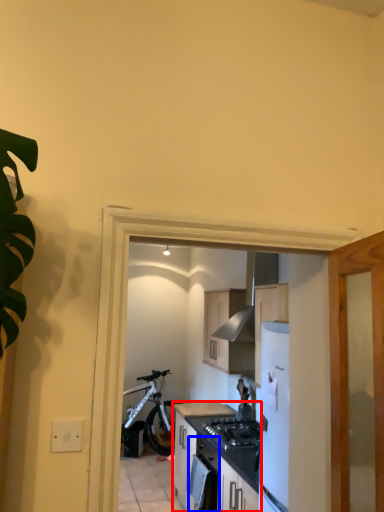
Question: Which point is further to the camera, cabinetry (highlighted by a red box) or oven (highlighted by a blue box)?

Choices:
 (A) cabinetry
 (B) oven

Answer: (A)